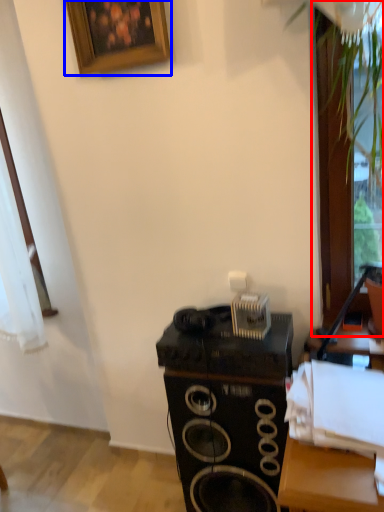
Question: Which object appears closest to the camera in this image, glass door (highlighted by a red box) or picture frame (highlighted by a blue box)?

Choices:
 (A) glass door
 (B) picture frame

Answer: (A)